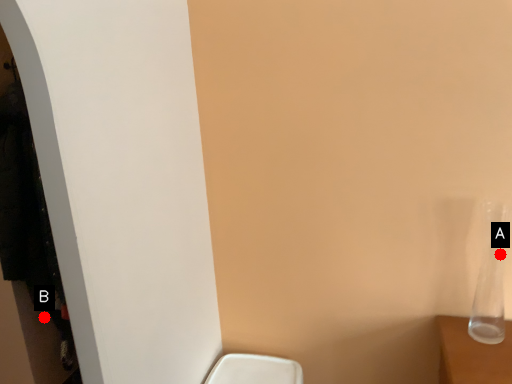
Question: Two points are circled on the image, labeled by A and B beside each circle. Which of the following is the farthest from the observer?

Choices:
 (A) A is further
 (B) B is further

Answer: (B)